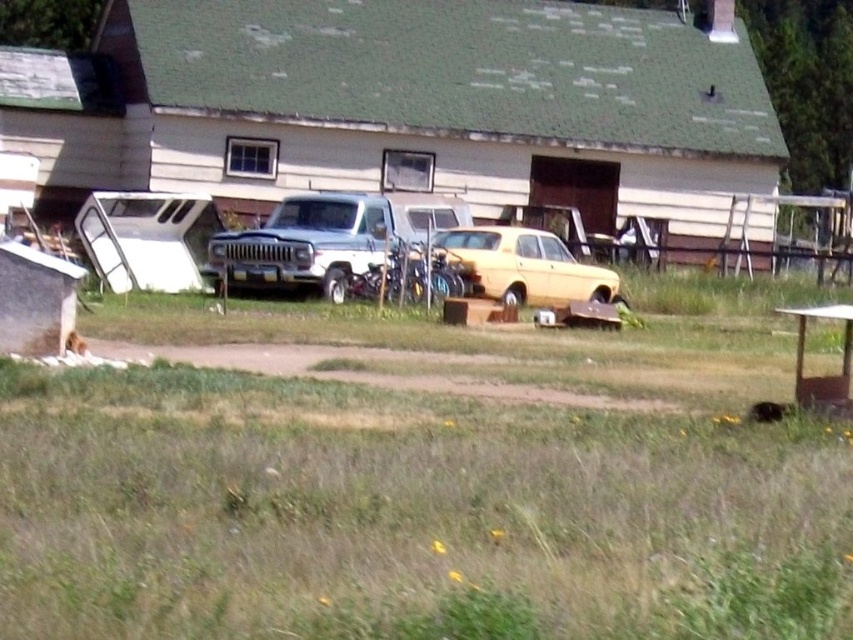
Consider the image. Is white matte truck at center further to the viewer compared to yellow matte car at center?

That is True.

Which is more to the left, white matte truck at center or yellow matte car at center?

Positioned to the left is white matte truck at center.

You are a GUI agent. You are given a task and a screenshot of the screen. Output one action in this format:
    pyautogui.click(x=<x>, y=<y>)
    Task: Click on the white matte truck at center
    
    Given the screenshot: What is the action you would take?
    pyautogui.click(x=305, y=243)

Does green shingled shed at center have a smaller size compared to white matte truck at center?

Incorrect, green shingled shed at center is not smaller in size than white matte truck at center.

Who is more forward, (x=129, y=33) or (x=317, y=272)?

Positioned in front is point (x=317, y=272).

The height and width of the screenshot is (640, 853). Find the location of `green shingled shed at center`. green shingled shed at center is located at coordinates (405, 106).

Is green shingled shed at center bigger than yellow matte car at center?

Yes, green shingled shed at center is bigger than yellow matte car at center.

Which is more to the right, green shingled shed at center or yellow matte car at center?

yellow matte car at center is more to the right.

Is point (648, 196) behind point (616, 289)?

Yes, it is.

At what (x,y) coordinates should I click in order to perform the action: click on green shingled shed at center. Please return your answer as a coordinate pair (x, y). The width and height of the screenshot is (853, 640). Looking at the image, I should click on (405, 106).